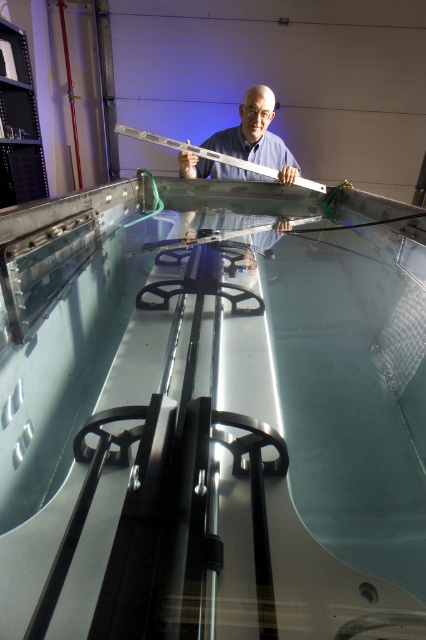
Question: Which point is closer to the camera?

Choices:
 (A) matte white ruler at center
 (B) metallic silver ruler at center

Answer: (B)

Question: Does matte white ruler at center come in front of metallic silver ruler at center?

Choices:
 (A) no
 (B) yes

Answer: (A)

Question: Does matte white ruler at center appear on the left side of metallic silver ruler at center?

Choices:
 (A) no
 (B) yes

Answer: (A)

Question: Which point is farther from the camera taking this photo?

Choices:
 (A) (236, 145)
 (B) (190, 147)

Answer: (A)

Question: Does matte white ruler at center appear on the right side of metallic silver ruler at center?

Choices:
 (A) no
 (B) yes

Answer: (B)